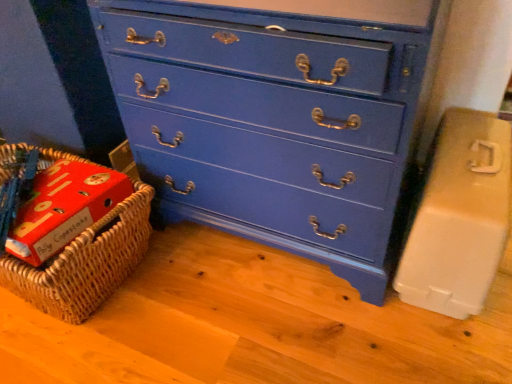
I want to click on woven brown basket at lower left, so coord(86,263).

Considering the sizes of beige plastic container at right and woven brown basket at lower left in the image, is beige plastic container at right wider or thinner than woven brown basket at lower left?

In the image, beige plastic container at right appears to be wider than woven brown basket at lower left.

Is beige plastic container at right in front of woven brown basket at lower left?

Yes, it is in front of woven brown basket at lower left.

In the scene shown: Is beige plastic container at right facing away from woven brown basket at lower left?

No, beige plastic container at right is not facing the opposite direction of woven brown basket at lower left.

Considering the positions of objects woven brown basket at lower left and blue painted wood chest of drawers at center in the image provided, who is in front, woven brown basket at lower left or blue painted wood chest of drawers at center?

blue painted wood chest of drawers at center is more forward.

Is woven brown basket at lower left situated inside blue painted wood chest of drawers at center or outside?

woven brown basket at lower left is not enclosed by blue painted wood chest of drawers at center.

From a real-world perspective, which is physically above, woven brown basket at lower left or blue painted wood chest of drawers at center?

blue painted wood chest of drawers at center.

Who is shorter, woven brown basket at lower left or blue painted wood chest of drawers at center?

woven brown basket at lower left is shorter.

Are blue painted wood chest of drawers at center and beige plastic container at right far apart?

blue painted wood chest of drawers at center is near beige plastic container at right, not far away.

In the scene shown: Is the position of blue painted wood chest of drawers at center more distant than that of beige plastic container at right?

No, blue painted wood chest of drawers at center is in front of beige plastic container at right.

From a real-world perspective, which is physically above, blue painted wood chest of drawers at center or beige plastic container at right?

blue painted wood chest of drawers at center, from a real-world perspective.

What's the angular difference between blue painted wood chest of drawers at center and beige plastic container at right's facing directions?

1.88 degrees separate the facing orientations of blue painted wood chest of drawers at center and beige plastic container at right.

Does woven brown basket at lower left turn towards beige plastic container at right?

No, woven brown basket at lower left is not turned towards beige plastic container at right.

Is woven brown basket at lower left not inside beige plastic container at right?

Yes, woven brown basket at lower left is not within beige plastic container at right.

Can you see woven brown basket at lower left touching beige plastic container at right?

woven brown basket at lower left and beige plastic container at right are not in contact.

Looking at the image, does woven brown basket at lower left seem bigger or smaller compared to beige plastic container at right?

Considering their sizes, woven brown basket at lower left takes up more space than beige plastic container at right.

Who is bigger, blue painted wood chest of drawers at center or woven brown basket at lower left?

blue painted wood chest of drawers at center.

From the image's perspective, which is below, blue painted wood chest of drawers at center or woven brown basket at lower left?

woven brown basket at lower left.

Is point (293, 118) closer or farther from the camera than point (85, 254)?

Point (293, 118) is positioned closer to the camera compared to point (85, 254).

Considering the positions of objects blue painted wood chest of drawers at center and woven brown basket at lower left in the image provided, who is more to the right, blue painted wood chest of drawers at center or woven brown basket at lower left?

blue painted wood chest of drawers at center is more to the right.

Is beige plastic container at right aimed at blue painted wood chest of drawers at center?

No, beige plastic container at right is not facing towards blue painted wood chest of drawers at center.

Between beige plastic container at right and blue painted wood chest of drawers at center, which one has larger size?

Bigger between the two is blue painted wood chest of drawers at center.

From the picture: Does beige plastic container at right come behind blue painted wood chest of drawers at center?

Yes, beige plastic container at right is behind blue painted wood chest of drawers at center.

Where is `basket located on the left of beige plastic container at right`? The image size is (512, 384). basket located on the left of beige plastic container at right is located at coordinates (86, 263).

Where is `basket that is under the blue painted wood chest of drawers at center (from a real-world perspective)`? basket that is under the blue painted wood chest of drawers at center (from a real-world perspective) is located at coordinates (86, 263).

When comparing their distances from woven brown basket at lower left, does blue painted wood chest of drawers at center or beige plastic container at right seem further?

The object further to woven brown basket at lower left is beige plastic container at right.

Based on their spatial positions, is woven brown basket at lower left or blue painted wood chest of drawers at center further from beige plastic container at right?

woven brown basket at lower left lies further to beige plastic container at right than the other object.

Looking at the image, which one is located closer to beige plastic container at right, blue painted wood chest of drawers at center or woven brown basket at lower left?

The object closer to beige plastic container at right is blue painted wood chest of drawers at center.

From the image, which object appears to be nearer to woven brown basket at lower left, beige plastic container at right or blue painted wood chest of drawers at center?

Among the two, blue painted wood chest of drawers at center is located nearer to woven brown basket at lower left.

Which object lies further to the anchor point blue painted wood chest of drawers at center, woven brown basket at lower left or beige plastic container at right?

The object further to blue painted wood chest of drawers at center is woven brown basket at lower left.

Based on their spatial positions, is beige plastic container at right or woven brown basket at lower left closer to blue painted wood chest of drawers at center?

beige plastic container at right lies closer to blue painted wood chest of drawers at center than the other object.

At what (x,y) coordinates should I click in order to perform the action: click on chest of drawers between woven brown basket at lower left and beige plastic container at right. Please return your answer as a coordinate pair (x, y). This screenshot has width=512, height=384. Looking at the image, I should click on (x=270, y=122).